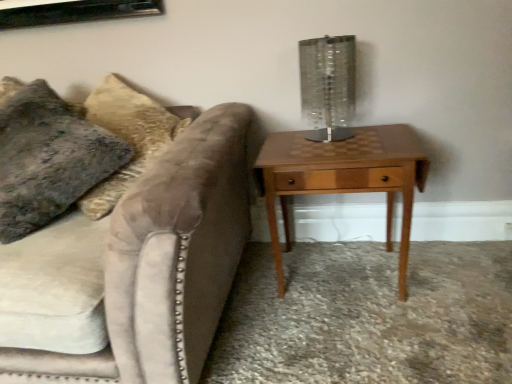
Where is `vacant area that is in front of woodenmaterial/texturenightstand at right`? This screenshot has height=384, width=512. vacant area that is in front of woodenmaterial/texturenightstand at right is located at coordinates (x=365, y=343).